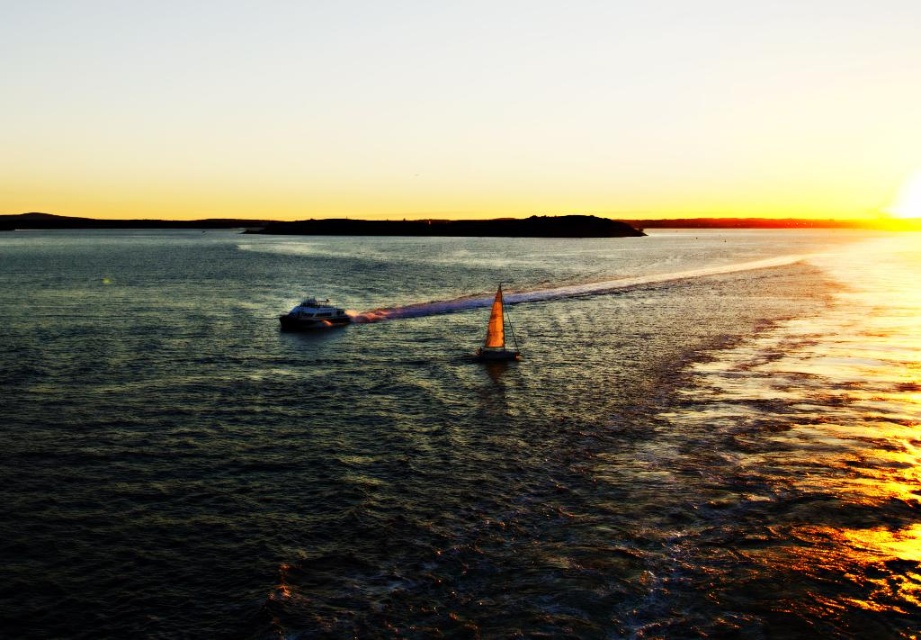
Can you confirm if dark blue water at center is positioned to the right of metallic silver boat at left?

Yes, dark blue water at center is to the right of metallic silver boat at left.

Which of these two, dark blue water at center or metallic silver boat at left, stands taller?

dark blue water at center

Find the location of `dark blue water at center`. dark blue water at center is located at coordinates coord(460,440).

Does dark blue water at center appear over orange sail at center?

Indeed, dark blue water at center is positioned over orange sail at center.

Which is more to the right, dark blue water at center or orange sail at center?

dark blue water at center is more to the right.

Who is more distant from viewer, (60, 392) or (494, 342)?

The point (494, 342) is behind.

Locate an element on the screen. The height and width of the screenshot is (640, 921). dark blue water at center is located at coordinates (460, 440).

Does metallic silver boat at left have a lesser width compared to orange sail at center?

Indeed, metallic silver boat at left has a lesser width compared to orange sail at center.

Who is more distant from viewer, (x=295, y=317) or (x=492, y=308)?

The point (x=295, y=317) is more distant.

What are the coordinates of `metallic silver boat at left` in the screenshot? It's located at (312, 316).

Find the location of `metallic silver boat at left`. metallic silver boat at left is located at coordinates (312, 316).